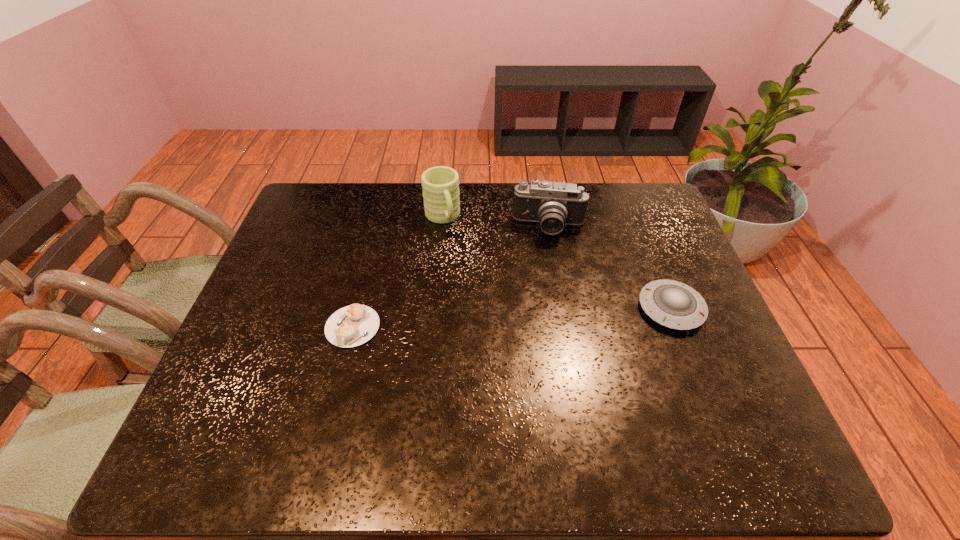
This screenshot has height=540, width=960. Identify the location of free space on the desktop that is between the shortest object and the third tallest object and is positioned on the side of the mug with the handle. (488, 319).

You are a GUI agent. You are given a task and a screenshot of the screen. Output one action in this format:
    pyautogui.click(x=<x>, y=<y>)
    Task: Click on the vacant space on the desktop that is between the leftmost object and the saucer and is positioned on the front-facing side of the third object from left to right
    
    Given the screenshot: What is the action you would take?
    pyautogui.click(x=545, y=315)